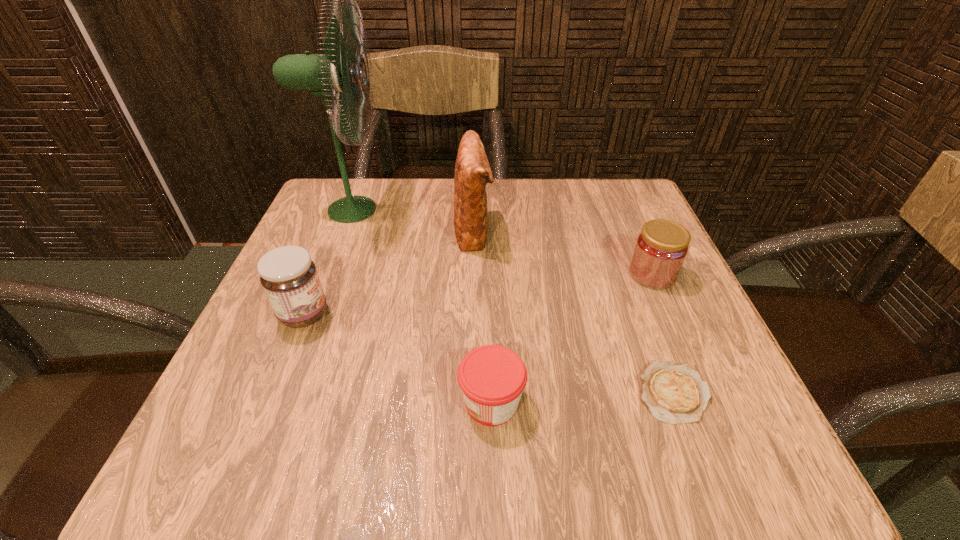
Image resolution: width=960 pixels, height=540 pixels. In order to click on vacant space at the right edge of the desktop in this screenshot , I will do `click(612, 266)`.

The width and height of the screenshot is (960, 540). What are the coordinates of `vacant space at the near left corner of the desktop` in the screenshot? It's located at (251, 439).

Locate an element on the screen. The width and height of the screenshot is (960, 540). vacant space at the far right corner of the desktop is located at coordinates (630, 228).

This screenshot has width=960, height=540. I want to click on vacant area that lies between the fan and the farthest jam, so click(501, 242).

Find the location of `vacant area that lies between the fan and the third farthest object`. vacant area that lies between the fan and the third farthest object is located at coordinates (501, 242).

Where is `free point between the clutch bag and the third tallest object`? free point between the clutch bag and the third tallest object is located at coordinates (389, 273).

The height and width of the screenshot is (540, 960). Identify the location of free space between the third nearest object and the fan. (327, 262).

Locate an element on the screen. The image size is (960, 540). vacant space that's between the fan and the leftmost jam is located at coordinates (327, 262).

Locate an element on the screen. vacant area between the fourth farthest object and the rightmost jam is located at coordinates (478, 294).

Identify the location of vacant area that lies between the tallest jam and the fan. (327, 262).